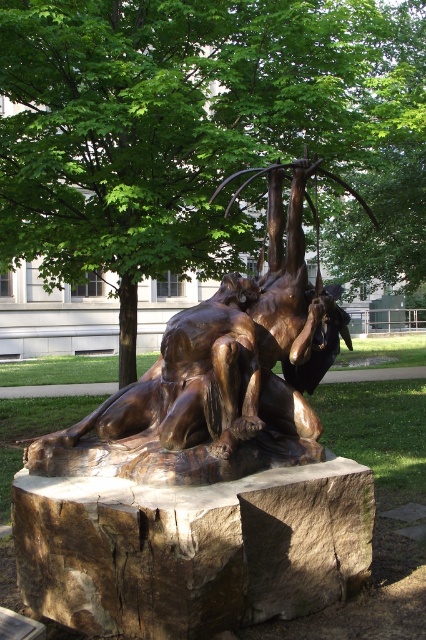
You are an artist planning to paint the scene and want to position your easel so that the brown rough stone at center is in the foreground. Based on its coordinates, where should you place your easel relative to the stone?

The brown rough stone at center is located at point [192,548], so you should place your easel in front of the stone to have it in the foreground.

You are an art student analyzing the sculpture in the park. You notice two bronze pieces at the center. Which one is taller between the bronze sculpture at center and the bronze statue at center?

The bronze sculpture at center is taller than the bronze statue at center.

You are an art student analyzing the sculpture in the park. You notice two parts labeled as the bronze sculpture at center and the bronze statue at center. Which one is positioned higher?

The bronze sculpture at center is positioned higher than the bronze statue at center.